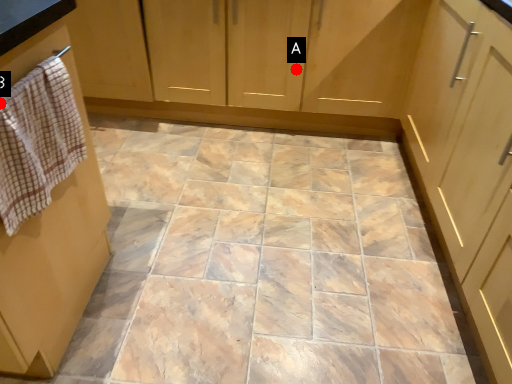
Question: Two points are circled on the image, labeled by A and B beside each circle. Which of the following is the farthest from the observer?

Choices:
 (A) A is further
 (B) B is further

Answer: (A)